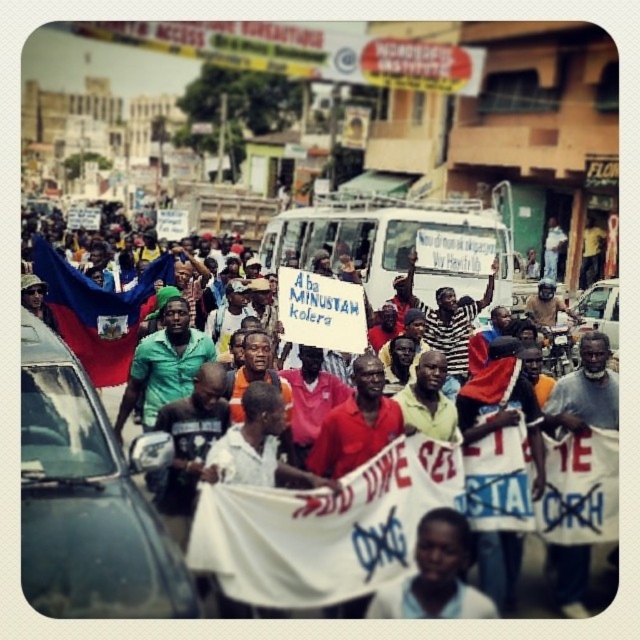
Is point (77, 504) closer to viewer compared to point (259, 301)?

Yes.

Does metallic silver car at left have a smaller size compared to white cotton shirt at center?

Indeed, metallic silver car at left has a smaller size compared to white cotton shirt at center.

The width and height of the screenshot is (640, 640). What are the coordinates of `metallic silver car at left` in the screenshot? It's located at (86, 500).

Locate an element on the screen. metallic silver car at left is located at coordinates (86, 500).

Does white cotton shirt at center come in front of light skin tone shirt at center?

No, white cotton shirt at center is behind light skin tone shirt at center.

Is white cotton shirt at center bigger than light skin tone shirt at center?

Yes.

Is point (420, 278) closer to viewer compared to point (460, 518)?

No, it is behind (460, 518).

The height and width of the screenshot is (640, 640). What are the coordinates of `white cotton shirt at center` in the screenshot? It's located at (120, 310).

Can you confirm if white paper banner at center is positioned below metallic silver car at right?

Yes.

Does point (385, 573) come in front of point (580, 323)?

Yes, it is in front of point (580, 323).

The height and width of the screenshot is (640, 640). I want to click on white paper banner at center, so click(x=324, y=529).